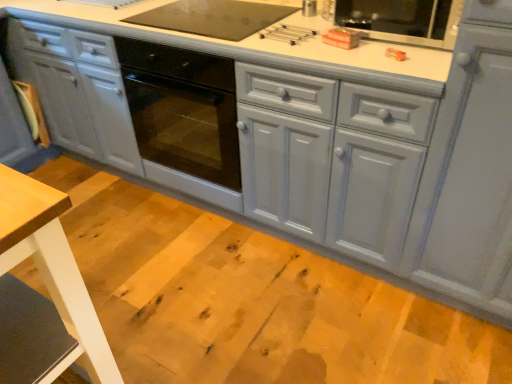
Question: From a real-world perspective, is matte gray cabinet at right located beneath light brown wood table at lower left?

Choices:
 (A) yes
 (B) no

Answer: (B)

Question: Is matte gray cabinet at right bigger than light brown wood table at lower left?

Choices:
 (A) no
 (B) yes

Answer: (B)

Question: Is matte gray cabinet at right next to light brown wood table at lower left and touching it?

Choices:
 (A) no
 (B) yes

Answer: (A)

Question: Is there a large distance between matte gray cabinet at right and light brown wood table at lower left?

Choices:
 (A) no
 (B) yes

Answer: (B)

Question: Is matte gray cabinet at right to the right of light brown wood table at lower left from the viewer's perspective?

Choices:
 (A) no
 (B) yes

Answer: (B)

Question: Is matte gray cabinet at right wider than light brown wood table at lower left?

Choices:
 (A) yes
 (B) no

Answer: (A)

Question: Is light brown wood table at lower left wider than matte gray cabinet at right?

Choices:
 (A) yes
 (B) no

Answer: (B)

Question: Is light brown wood table at lower left at the left side of matte gray cabinet at right?

Choices:
 (A) yes
 (B) no

Answer: (A)

Question: From the image's perspective, is light brown wood table at lower left on top of matte gray cabinet at right?

Choices:
 (A) yes
 (B) no

Answer: (B)

Question: From the image's perspective, would you say light brown wood table at lower left is shown under matte gray cabinet at right?

Choices:
 (A) yes
 (B) no

Answer: (A)

Question: Could you tell me if light brown wood table at lower left is facing matte gray cabinet at right?

Choices:
 (A) yes
 (B) no

Answer: (B)

Question: Can you confirm if light brown wood table at lower left is taller than matte gray cabinet at right?

Choices:
 (A) no
 (B) yes

Answer: (A)

Question: In terms of width, does matte gray cabinet at right look wider or thinner when compared to light brown wood table at lower left?

Choices:
 (A) wide
 (B) thin

Answer: (A)